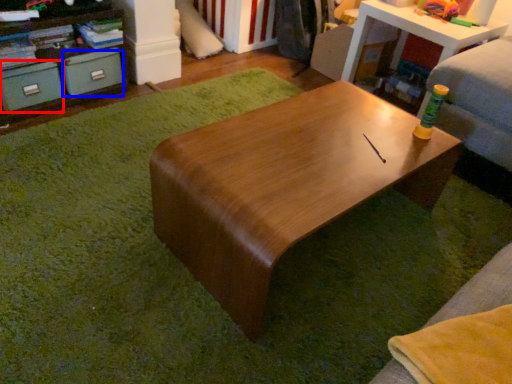
Question: Which of the following is the closest to the observer, drawer (highlighted by a red box) or drawer (highlighted by a blue box)?

Choices:
 (A) drawer
 (B) drawer

Answer: (A)